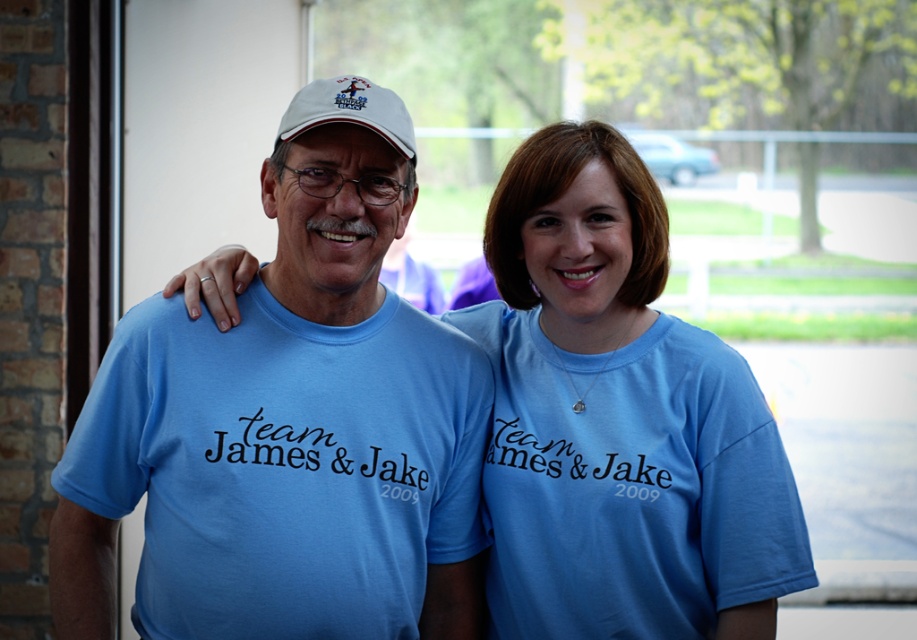
Is matte blue t-shirt at center bigger than white fabric baseball cap at upper center?

Correct, matte blue t-shirt at center is larger in size than white fabric baseball cap at upper center.

The width and height of the screenshot is (917, 640). Identify the location of matte blue t-shirt at center. (290, 422).

Find the location of a particular element. matte blue t-shirt at center is located at coordinates (290, 422).

Is point (159, 536) closer to camera compared to point (611, 493)?

That is True.

The image size is (917, 640). Identify the location of matte blue t-shirt at center. (290, 422).

Can you confirm if blue cotton t-shirt at center is positioned to the left of white fabric baseball cap at upper center?

No, blue cotton t-shirt at center is not to the left of white fabric baseball cap at upper center.

Does point (500, 380) lie behind point (373, 88)?

Yes, point (500, 380) is behind point (373, 88).

What do you see at coordinates (617, 420) in the screenshot? The height and width of the screenshot is (640, 917). I see `blue cotton t-shirt at center` at bounding box center [617, 420].

Image resolution: width=917 pixels, height=640 pixels. Identify the location of blue cotton t-shirt at center. (617, 420).